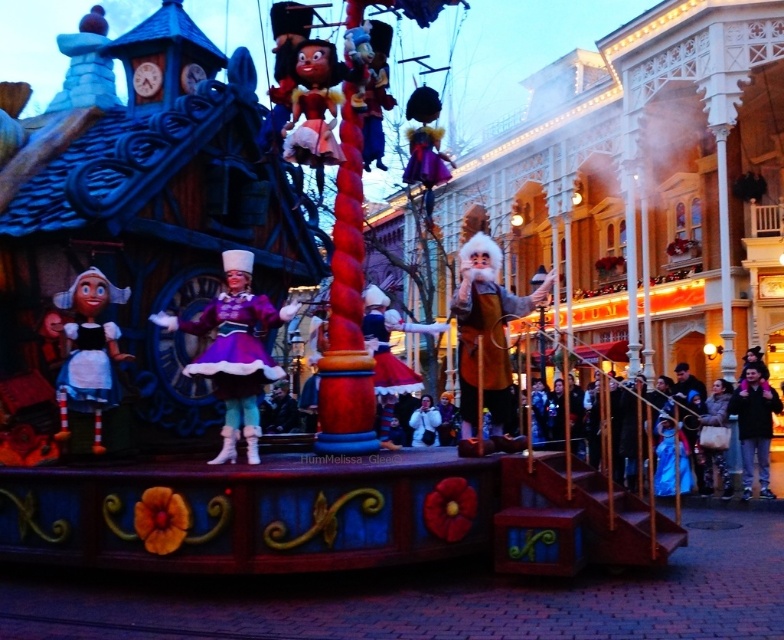
Consider the image. Which of these two, brown woolen coat at center or matte white fabric doll at left, stands taller?

brown woolen coat at center

I want to click on brown woolen coat at center, so click(487, 337).

The height and width of the screenshot is (640, 784). Identify the location of brown woolen coat at center. (487, 337).

In the scene shown: Is brown woolen coat at center thinner than white fluffy coat at center?

No.

Who is taller, brown woolen coat at center or white fluffy coat at center?

brown woolen coat at center

Image resolution: width=784 pixels, height=640 pixels. I want to click on brown woolen coat at center, so click(487, 337).

Is point (216, 301) positioned in front of point (764, 481)?

Yes, it is.

Does matte purple fabric dress at center appear on the right side of black leather jacket at lower right?

No, matte purple fabric dress at center is not to the right of black leather jacket at lower right.

Is point (242, 282) less distant than point (750, 433)?

Yes.

You are a GUI agent. You are given a task and a screenshot of the screen. Output one action in this format:
    pyautogui.click(x=<x>, y=<y>)
    Task: Click on the matte purple fabric dress at center
    The image size is (784, 640).
    Given the screenshot: What is the action you would take?
    pyautogui.click(x=234, y=352)